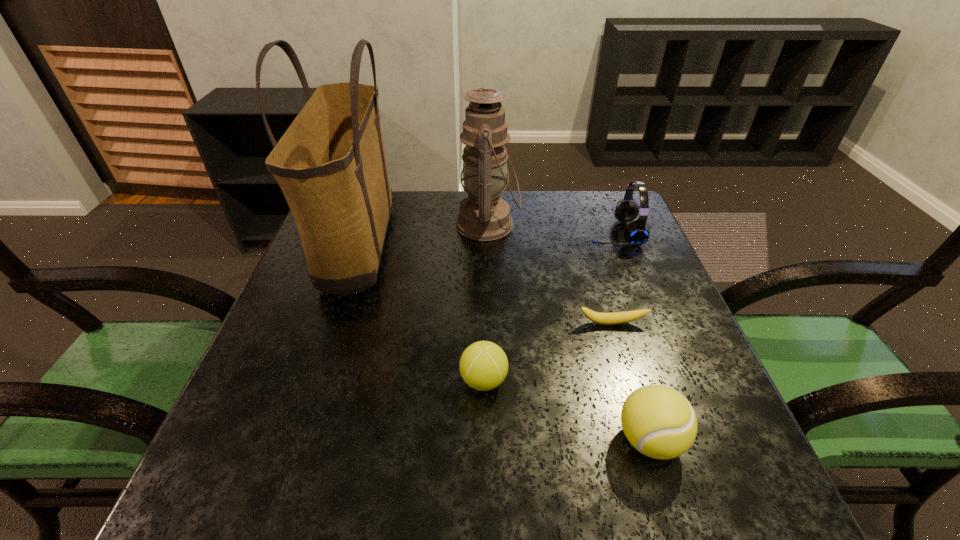
Find the location of a particular element. Image resolution: width=960 pixels, height=540 pixels. free space between the tote bag and the third tallest object is located at coordinates (486, 242).

In order to click on free space between the fifth farthest object and the fourth tallest object in this screenshot , I will do `click(566, 410)`.

Locate an element on the screen. The width and height of the screenshot is (960, 540). blank region between the farther tennis ball and the banana is located at coordinates tap(547, 352).

This screenshot has height=540, width=960. Find the location of `free space between the third shortest object and the headset`. free space between the third shortest object and the headset is located at coordinates [x=632, y=336].

You are a GUI agent. You are given a task and a screenshot of the screen. Output one action in this format:
    pyautogui.click(x=<x>, y=<y>)
    Task: Click on the object that is the fourth nearest to the oil lamp
    
    Given the screenshot: What is the action you would take?
    pyautogui.click(x=483, y=365)

Choose which object is the fourth nearest neighbor to the banana. Please provide its 2D coordinates. Your answer should be formatted as a tuple, i.e. [(x, y)], where the tuple contains the x and y coordinates of a point satisfying the conditions above.

[(484, 215)]

Where is `vacant point that satisfies the following two spatial constraints: 1. on the front side of the nearest object; 2. on the left side of the fifth tallest object`? Image resolution: width=960 pixels, height=540 pixels. vacant point that satisfies the following two spatial constraints: 1. on the front side of the nearest object; 2. on the left side of the fifth tallest object is located at coordinates (484, 440).

You are a GUI agent. You are given a task and a screenshot of the screen. Output one action in this format:
    pyautogui.click(x=<x>, y=<y>)
    Task: Click on the free region that satisfies the following two spatial constraints: 1. on the front side of the fourth tallest object; 2. on the left side of the fifth shortest object
    The width and height of the screenshot is (960, 540).
    Given the screenshot: What is the action you would take?
    pyautogui.click(x=492, y=440)